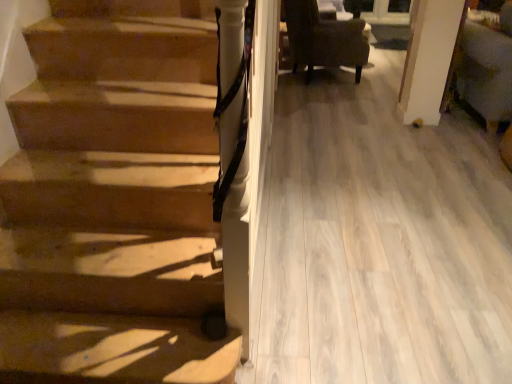
Describe the element at coordinates (486, 65) in the screenshot. I see `velvet green armchair at right` at that location.

Consider the image. Measure the distance between point (506,14) and camera.

The distance of point (506,14) from camera is 3.47 meters.

Locate an element on the screen. velvet green armchair at right is located at coordinates (486, 65).

The image size is (512, 384). What do you see at coordinates (324, 39) in the screenshot?
I see `dark brown fabric chair at upper right` at bounding box center [324, 39].

Locate an element on the screen. The image size is (512, 384). dark brown fabric chair at upper right is located at coordinates point(324,39).

Identify the location of velvet green armchair at right. The image size is (512, 384). (486, 65).

Can you confirm if dark brown fabric chair at upper right is positioned to the left of velvet green armchair at right?

Correct, you'll find dark brown fabric chair at upper right to the left of velvet green armchair at right.

Which object is more forward, dark brown fabric chair at upper right or velvet green armchair at right?

velvet green armchair at right is more forward.

Is point (359, 23) farther from viewer compared to point (492, 54)?

Yes.

From the image's perspective, between dark brown fabric chair at upper right and velvet green armchair at right, which one is located above?

dark brown fabric chair at upper right appears higher in the image.

From a real-world perspective, who is located lower, dark brown fabric chair at upper right or velvet green armchair at right?

In real-world perspective, dark brown fabric chair at upper right is lower.

Between dark brown fabric chair at upper right and velvet green armchair at right, which one has larger width?

velvet green armchair at right.

Considering the relative sizes of dark brown fabric chair at upper right and velvet green armchair at right in the image provided, is dark brown fabric chair at upper right taller than velvet green armchair at right?

No.

Who is smaller, dark brown fabric chair at upper right or velvet green armchair at right?

With smaller size is dark brown fabric chair at upper right.

Choose the correct answer: Is dark brown fabric chair at upper right inside velvet green armchair at right or outside it?

dark brown fabric chair at upper right lies outside velvet green armchair at right.

Are dark brown fabric chair at upper right and velvet green armchair at right located far from each other?

dark brown fabric chair at upper right is far away from velvet green armchair at right.

Is dark brown fabric chair at upper right positioned with its back to velvet green armchair at right?

No, dark brown fabric chair at upper right is not facing the opposite direction of velvet green armchair at right.

How many degrees apart are the facing directions of dark brown fabric chair at upper right and velvet green armchair at right?

The angle between the facing direction of dark brown fabric chair at upper right and the facing direction of velvet green armchair at right is 72.2 degrees.

Identify the location of chair that appears below the velvet green armchair at right (from a real-world perspective). Image resolution: width=512 pixels, height=384 pixels. (324, 39).

From the picture: Would you say velvet green armchair at right is to the left or to the right of dark brown fabric chair at upper right in the picture?

Clearly, velvet green armchair at right is on the right of dark brown fabric chair at upper right in the image.

Does velvet green armchair at right lie behind dark brown fabric chair at upper right?

No, the depth of velvet green armchair at right is less than that of dark brown fabric chair at upper right.

Is point (498, 23) closer or farther from the camera than point (358, 62)?

Clearly, point (498, 23) is closer to the camera than point (358, 62).

From the image's perspective, is velvet green armchair at right above or below dark brown fabric chair at upper right?

Based on their image positions, velvet green armchair at right is located beneath dark brown fabric chair at upper right.

From the picture: From a real-world perspective, who is located lower, velvet green armchair at right or dark brown fabric chair at upper right?

dark brown fabric chair at upper right.

Considering the relative sizes of velvet green armchair at right and dark brown fabric chair at upper right in the image provided, is velvet green armchair at right thinner than dark brown fabric chair at upper right?

Incorrect, the width of velvet green armchair at right is not less than that of dark brown fabric chair at upper right.

Which of these two, velvet green armchair at right or dark brown fabric chair at upper right, stands taller?

With more height is velvet green armchair at right.

Which of these two, velvet green armchair at right or dark brown fabric chair at upper right, is smaller?

dark brown fabric chair at upper right is smaller.

Is velvet green armchair at right spatially inside dark brown fabric chair at upper right, or outside of it?

The correct answer is: outside.

Are velvet green armchair at right and dark brown fabric chair at upper right making contact?

velvet green armchair at right is not next to dark brown fabric chair at upper right, and they're not touching.

Is velvet green armchair at right positioned with its back to dark brown fabric chair at upper right?

That's not correct — velvet green armchair at right is not looking away from dark brown fabric chair at upper right.

What's the angular difference between velvet green armchair at right and dark brown fabric chair at upper right's facing directions?

72.2 degrees.

Measure the distance from velvet green armchair at right to dark brown fabric chair at upper right.

They are 3.95 feet apart.

At what (x,y) coordinates should I click in order to perform the action: click on chair above the velvet green armchair at right (from the image's perspective). Please return your answer as a coordinate pair (x, y). This screenshot has height=384, width=512. Looking at the image, I should click on (324, 39).

In the image, there is a dark brown fabric chair at upper right. At what (x,y) coordinates should I click in order to perform the action: click on armchair below it (from the image's perspective). Please return your answer as a coordinate pair (x, y). This screenshot has height=384, width=512. Looking at the image, I should click on (486, 65).

Locate an element on the screen. Image resolution: width=512 pixels, height=384 pixels. chair that appears above the velvet green armchair at right (from the image's perspective) is located at coordinates (324, 39).